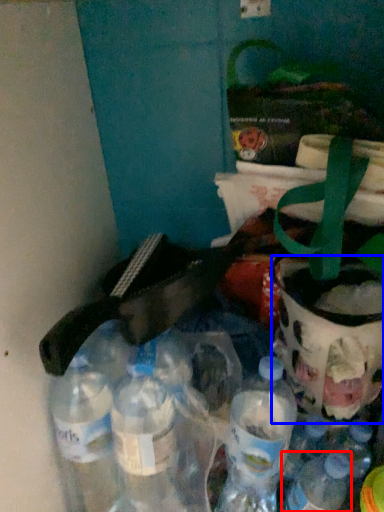
Question: Which object appears farthest to the camera in this image, bottle (highlighted by a red box) or glass jar (highlighted by a blue box)?

Choices:
 (A) bottle
 (B) glass jar

Answer: (B)